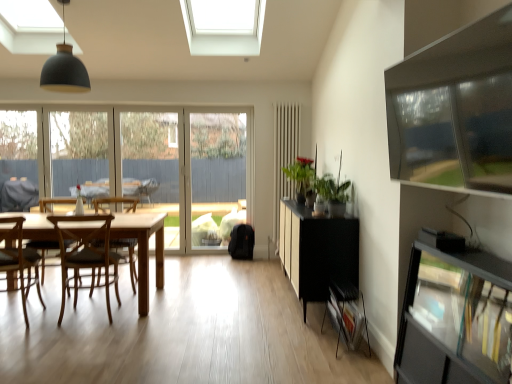
Question: Could you tell me if wooden chair at left, the third chair when ordered from back to front, is turned towards transparent glass shelf at right?

Choices:
 (A) no
 (B) yes

Answer: (A)

Question: Is transparent glass shelf at right a part of wooden chair at left, which is the 1th chair in front-to-back order?

Choices:
 (A) no
 (B) yes

Answer: (A)

Question: From a real-world perspective, is wooden chair at left, which is the 1th chair in front-to-back order, over transparent glass shelf at right?

Choices:
 (A) yes
 (B) no

Answer: (A)

Question: Considering the relative positions of wooden chair at left, which is the 1th chair in front-to-back order, and transparent glass shelf at right in the image provided, is wooden chair at left, which is the 1th chair in front-to-back order, to the right of transparent glass shelf at right from the viewer's perspective?

Choices:
 (A) no
 (B) yes

Answer: (A)

Question: Is wooden chair at left, the third chair when ordered from back to front, not inside transparent glass shelf at right?

Choices:
 (A) yes
 (B) no

Answer: (A)

Question: Considering the positions of wooden chair at left, the second chair positioned from the front, and transparent glass door at center, the 2th window frame in the left-to-right sequence, in the image, is wooden chair at left, the second chair positioned from the front, wider or thinner than transparent glass door at center, the 2th window frame in the left-to-right sequence,?

Choices:
 (A) wide
 (B) thin

Answer: (A)

Question: Looking at the image, does wooden chair at left, the second chair positioned from the front, seem bigger or smaller compared to transparent glass door at center, which appears as the 1th window frame when viewed from the right?

Choices:
 (A) small
 (B) big

Answer: (B)

Question: Based on their positions, is wooden chair at left, which appears as the 2th chair when viewed from the back, located to the left or right of transparent glass door at center, which appears as the 1th window frame when viewed from the right?

Choices:
 (A) right
 (B) left

Answer: (B)

Question: Do you think wooden chair at left, which appears as the 2th chair when viewed from the back, is within transparent glass door at center, the 2th window frame in the left-to-right sequence, or outside of it?

Choices:
 (A) outside
 (B) inside

Answer: (A)

Question: Considering the positions of wooden chair at center, which appears as the 1th chair when viewed from the back, and wooden chair at left, the second chair positioned from the front, in the image, is wooden chair at center, which appears as the 1th chair when viewed from the back, wider or thinner than wooden chair at left, the second chair positioned from the front,?

Choices:
 (A) thin
 (B) wide

Answer: (A)

Question: From the image's perspective, is wooden chair at center, which appears as the 1th chair when viewed from the back, positioned above or below wooden chair at left, the second chair positioned from the front?

Choices:
 (A) above
 (B) below

Answer: (A)

Question: In terms of size, does wooden chair at center, acting as the third chair starting from the front, appear bigger or smaller than wooden chair at left, which appears as the 2th chair when viewed from the back?

Choices:
 (A) big
 (B) small

Answer: (A)

Question: From their relative heights in the image, would you say wooden chair at center, acting as the third chair starting from the front, is taller or shorter than wooden chair at left, which appears as the 2th chair when viewed from the back?

Choices:
 (A) tall
 (B) short

Answer: (A)

Question: Is point (100, 158) closer or farther from the camera than point (129, 243)?

Choices:
 (A) closer
 (B) farther

Answer: (B)

Question: Considering their positions, is clear glass door at center located in front of or behind wooden chair at center, acting as the third chair starting from the front?

Choices:
 (A) behind
 (B) front

Answer: (A)